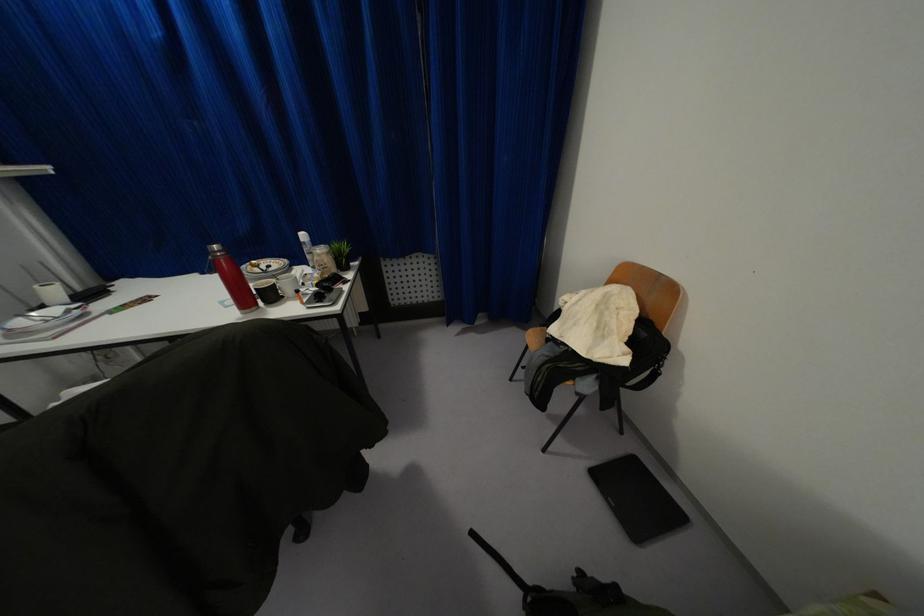
Which object does [289,283] point to?

This point indicates the white coffee mug.